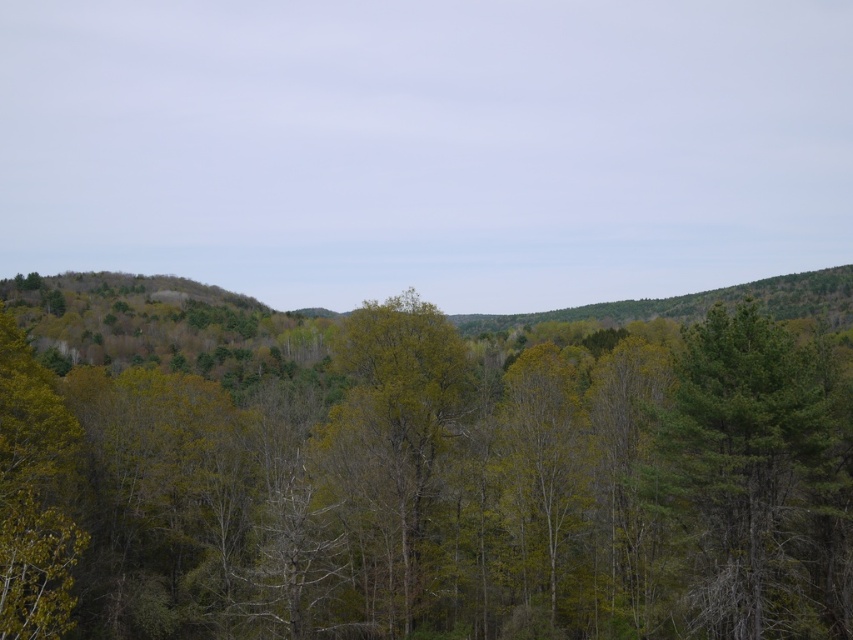
Find the location of a particular element. The image size is (853, 640). green matte tree at center is located at coordinates (426, 481).